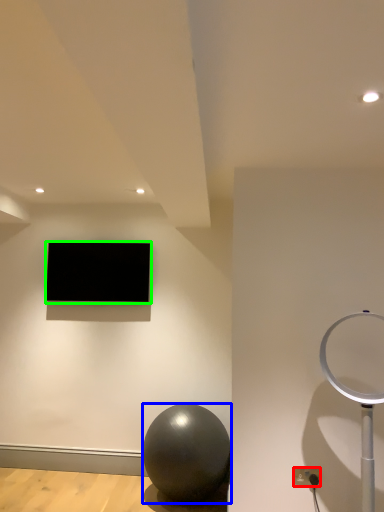
Question: Based on their relative distances, which object is nearer to electric outlet (highlighted by a red box)? Choose from ball (highlighted by a blue box) and television (highlighted by a green box).

Choices:
 (A) ball
 (B) television

Answer: (A)